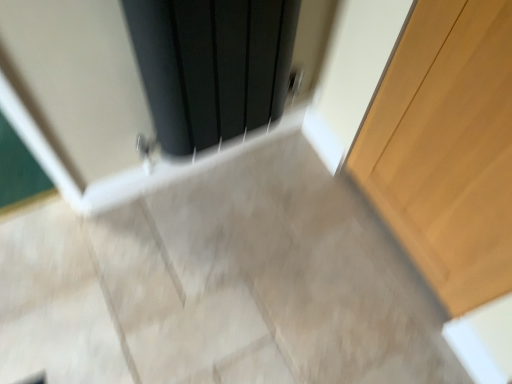
Question: Relative to matte black radiator at upper center, is light wood door at right in front or behind?

Choices:
 (A) front
 (B) behind

Answer: (A)

Question: Is light wood door at right taller or shorter than matte black radiator at upper center?

Choices:
 (A) short
 (B) tall

Answer: (B)

Question: Is light wood door at right wider or thinner than matte black radiator at upper center?

Choices:
 (A) wide
 (B) thin

Answer: (B)

Question: Looking at the image, does matte black radiator at upper center seem bigger or smaller compared to light wood door at right?

Choices:
 (A) small
 (B) big

Answer: (B)

Question: Considering the positions of matte black radiator at upper center and light wood door at right in the image, is matte black radiator at upper center taller or shorter than light wood door at right?

Choices:
 (A) short
 (B) tall

Answer: (A)

Question: Considering the relative positions of matte black radiator at upper center and light wood door at right in the image provided, is matte black radiator at upper center to the left or to the right of light wood door at right?

Choices:
 (A) left
 (B) right

Answer: (A)

Question: From a real-world perspective, is matte black radiator at upper center positioned above or below light wood door at right?

Choices:
 (A) below
 (B) above

Answer: (B)